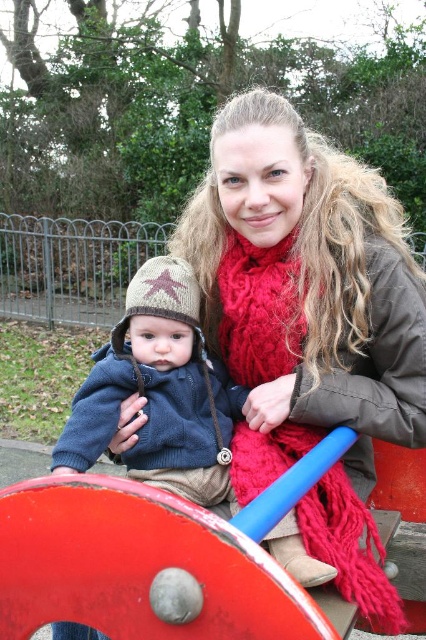
You are a fashion designer observing the knitted brown hat at center and the red knitted scarf at center. Which item has a smaller width?

The knitted brown hat at center is thinner than the red knitted scarf at center, so the knitted brown hat at center has a smaller width.

You are a photographer standing at the playground. You want to take a closeup photo of the knitted brown hat at center. The camera you are using has a minimum focusing distance of 4 feet. Will you be able to take the photo without moving closer?

The knitted brown hat at center is 4.27 feet away from the camera. Since the minimum focusing distance is 4 feet, the camera can focus on the knitted brown hat at center as it is within range.

You are a photographer trying to capture a closeup of the child in the scene. You notice the knitted brown hat at center and the red knitted scarf at center. Which object should you focus on to ensure the child is in the center of your photo?

The knitted brown hat at center is to the left of red knitted scarf at center, so focusing on the red knitted scarf at center would center the child in the photo since it is positioned more towards the right.